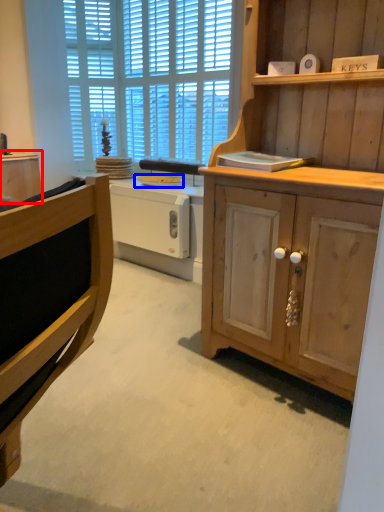
Question: Which object is closer to the camera taking this photo, cabinetry (highlighted by a red box) or appliance (highlighted by a blue box)?

Choices:
 (A) cabinetry
 (B) appliance

Answer: (B)